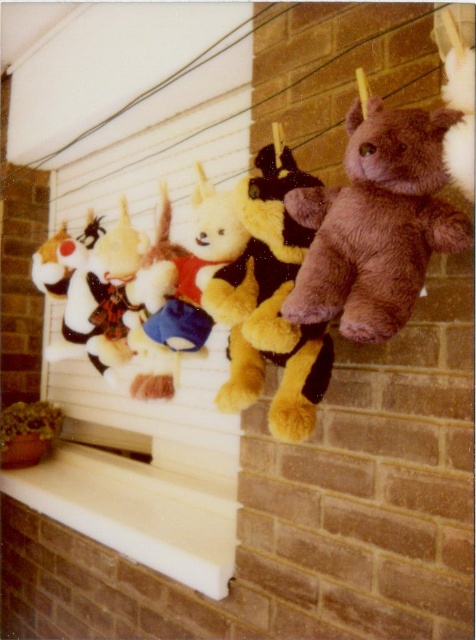
Question: Based on their relative distances, which object is farther from the fluffy white teddy bear at center?

Choices:
 (A) fuzzy brown teddy bear at center
 (B) white smooth ledge at lower center

Answer: (B)

Question: Based on their relative distances, which object is nearer to the brown plush bear at upper right?

Choices:
 (A) fluffy white teddy bear at center
 (B) white smooth ledge at lower center

Answer: (A)

Question: Can you confirm if brown plush bear at upper right is thinner than white smooth ledge at lower center?

Choices:
 (A) no
 (B) yes

Answer: (B)

Question: Which object is closer to the camera taking this photo?

Choices:
 (A) white smooth ledge at lower center
 (B) fluffy white teddy bear at center

Answer: (B)

Question: Does brown plush bear at upper right appear under fuzzy brown teddy bear at center?

Choices:
 (A) yes
 (B) no

Answer: (B)

Question: Is brown plush bear at upper right closer to camera compared to fluffy white teddy bear at center?

Choices:
 (A) no
 (B) yes

Answer: (B)